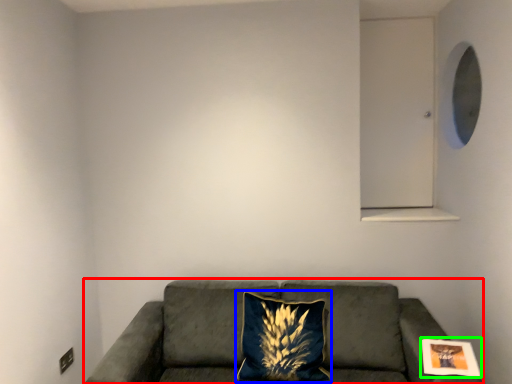
Question: Considering the real-world distances, which object is closest to studio couch (highlighted by a red box)? pillow (highlighted by a blue box) or picture frame (highlighted by a green box).

Choices:
 (A) pillow
 (B) picture frame

Answer: (A)